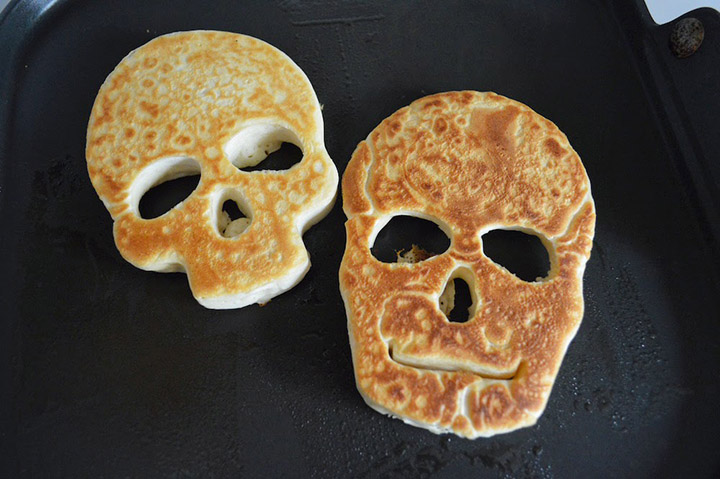
What are the coordinates of `baking pan` in the screenshot? It's located at [x=152, y=286].